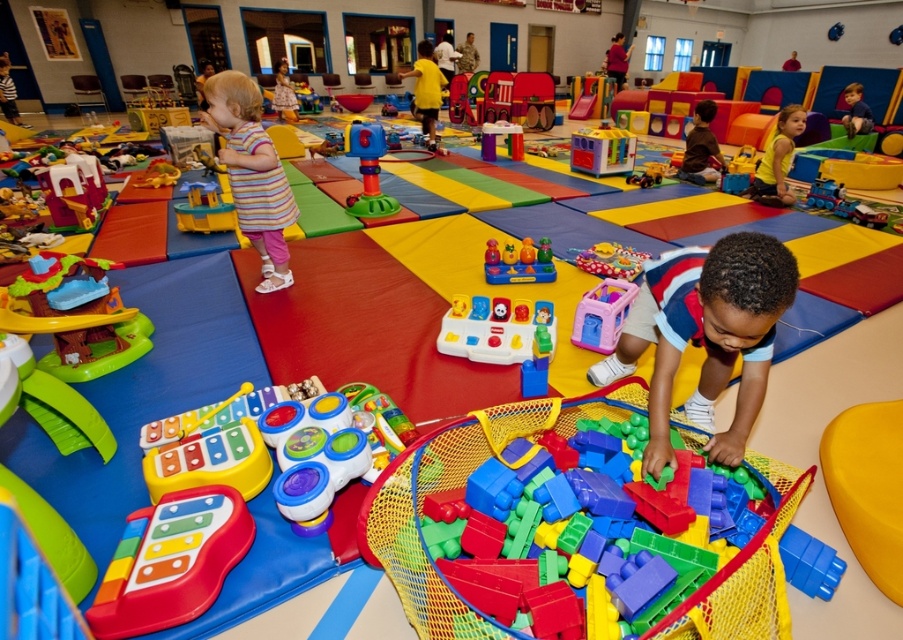
Question: Which of the following is the farthest from the observer?

Choices:
 (A) striped fabric dress at left
 (B) matte plastic building block at center
 (C) yellow plastic playhouse at upper left
 (D) metallic blue train at lower right

Answer: (B)

Question: From the image, what is the correct spatial relationship of white plastic toy at center in relation to rubberized plastic toy car at center?

Choices:
 (A) above
 (B) below

Answer: (B)

Question: Does multicolored plastic blocks at lower right have a lesser width compared to translucent plastic cup at center?

Choices:
 (A) no
 (B) yes

Answer: (A)

Question: Which of these objects is positioned farthest from the rubber xylophone at lower left?

Choices:
 (A) multicolored plastic toy at center
 (B) rubberized plastic toy car at center

Answer: (B)

Question: Considering the relative positions of multicolored plastic blocks at lower right and green plastic blocks at center in the image provided, where is multicolored plastic blocks at lower right located with respect to green plastic blocks at center?

Choices:
 (A) below
 (B) above

Answer: (A)

Question: Considering the real-world distances, which object is closest to the rubberized plastic toy car at center?

Choices:
 (A) multicolored plastic blocks at lower right
 (B) striped fabric dress at left

Answer: (B)